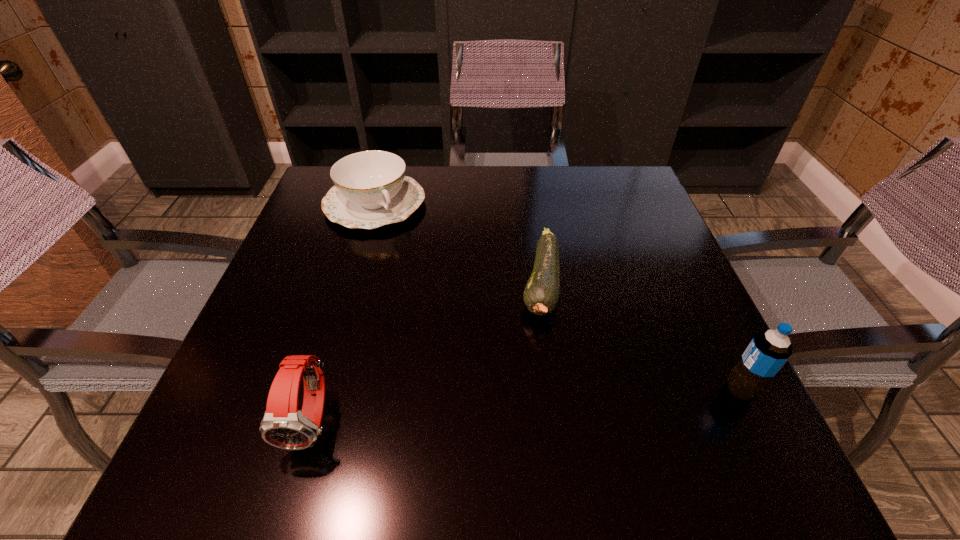
Image resolution: width=960 pixels, height=540 pixels. I want to click on vacant spot on the desktop that is between the third shortest object and the soda bottle and is positioned at the blossom end of the third nearest object, so click(x=513, y=406).

You are a GUI agent. You are given a task and a screenshot of the screen. Output one action in this format:
    pyautogui.click(x=<x>, y=<y>)
    Task: Click on the free space on the desktop that is between the watch and the rightmost object and is positioned on the handle side of the third tallest object
    The image size is (960, 540).
    Given the screenshot: What is the action you would take?
    pyautogui.click(x=524, y=405)